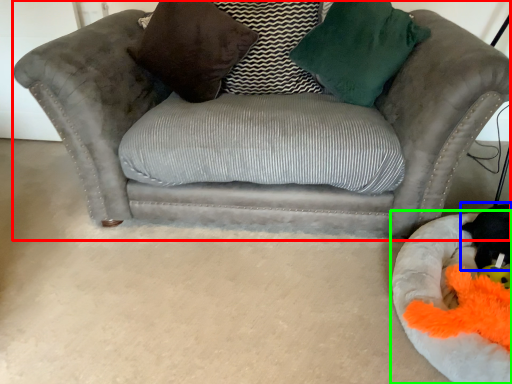
Question: Which object is positioned closest to studio couch (highlighted by a red box)? Select from animal (highlighted by a blue box) and dog bed (highlighted by a green box).

Choices:
 (A) animal
 (B) dog bed

Answer: (B)